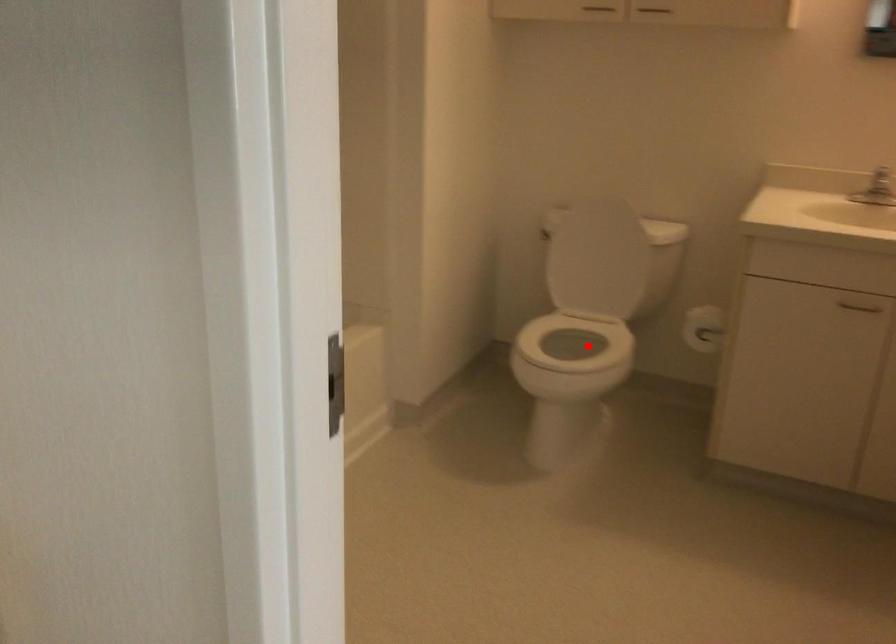
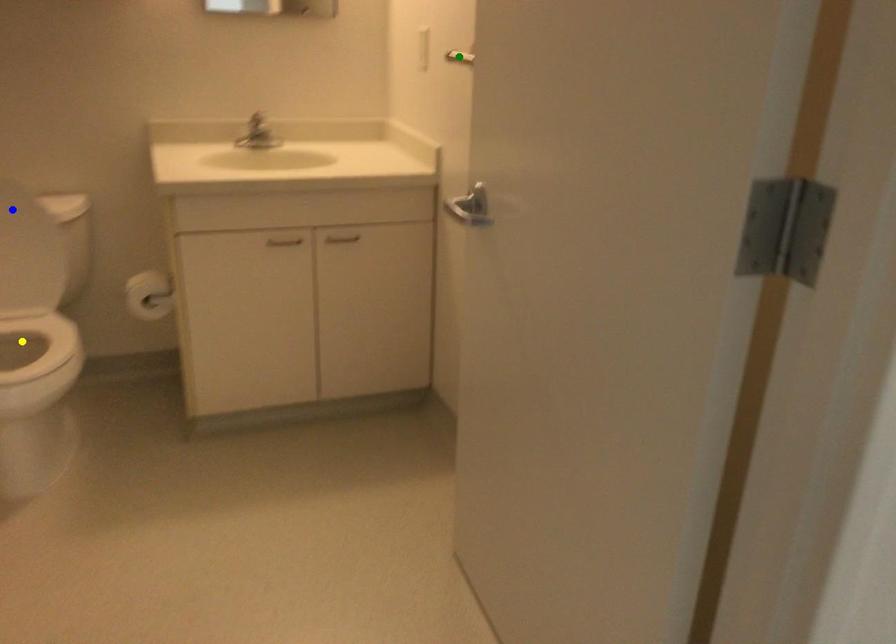
Question: I am providing you with two images of the same scene from different viewpoints. A red point is marked on the first image. You are given multiple points on the second image. Which mark in image 2 goes with the point in image 1?

Choices:
 (A) blue point
 (B) green point
 (C) yellow point

Answer: (C)